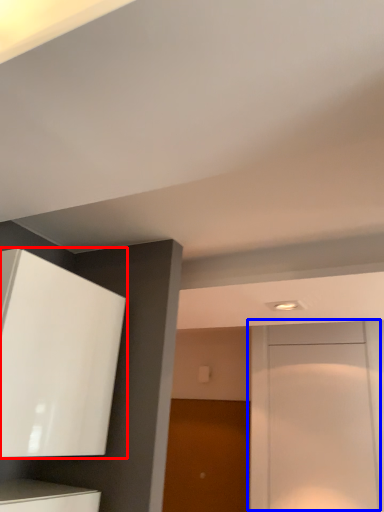
Question: Which point is further to the camera, cabinetry (highlighted by a red box) or door (highlighted by a blue box)?

Choices:
 (A) cabinetry
 (B) door

Answer: (B)